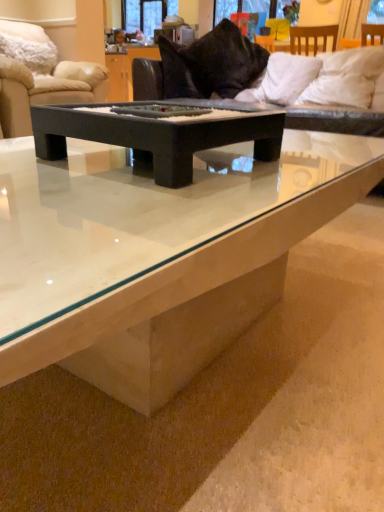
Locate an element on the screen. The height and width of the screenshot is (512, 384). vacant area that is in front of black matte tray at center, the 2th coffee table in the bottom-to-top sequence is located at coordinates [x=140, y=197].